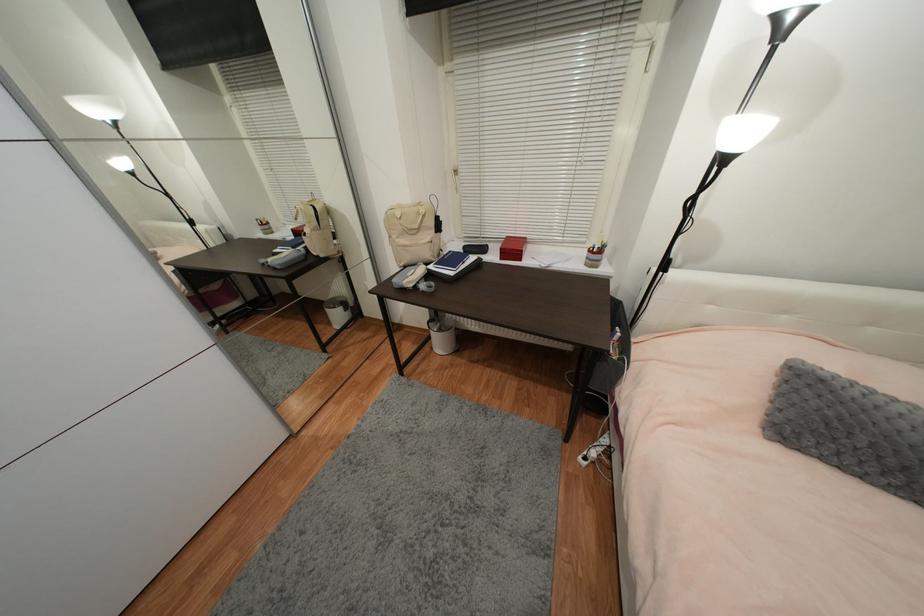
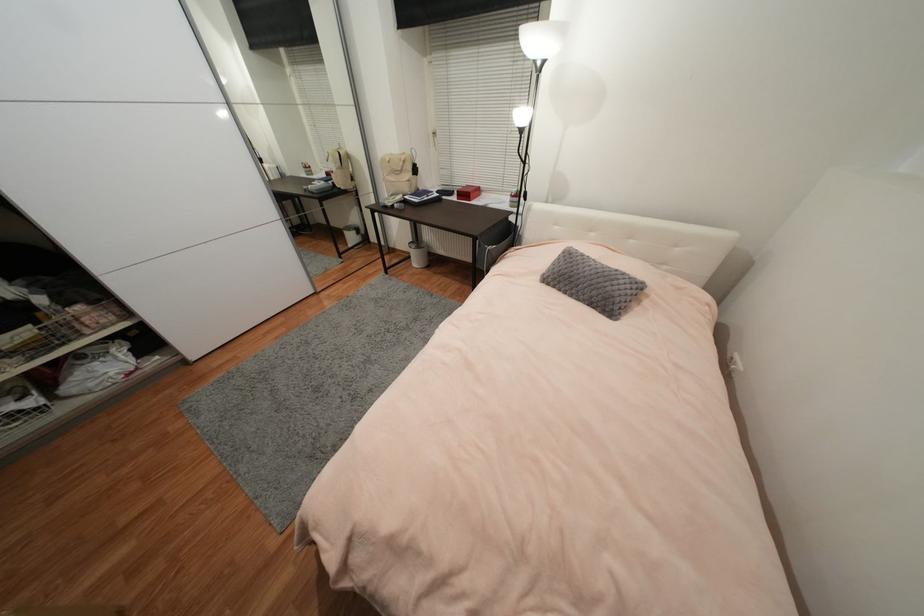
Locate, in the second image, the point that corresponds to pixel 496 257 in the first image.

(458, 199)